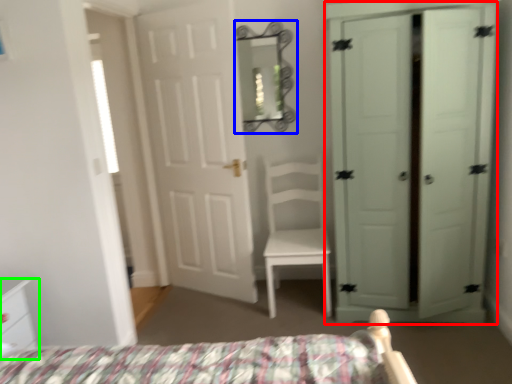
Question: Which object is positioned closest to door (highlighted by a red box)? Select from mirror (highlighted by a blue box) and nightstand (highlighted by a green box).

Choices:
 (A) mirror
 (B) nightstand

Answer: (A)